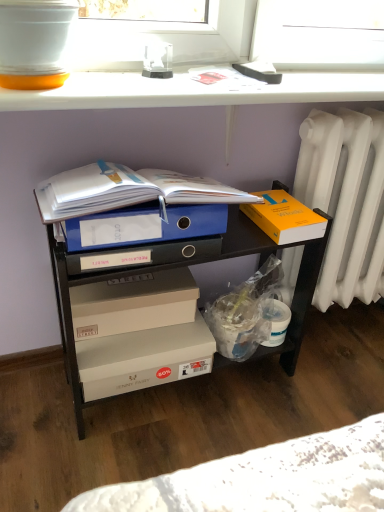
Question: Visually, is blue plastic file at center positioned to the left or to the right of white glossy window sill at upper center?

Choices:
 (A) left
 (B) right

Answer: (A)

Question: From their relative heights in the image, would you say blue plastic file at center is taller or shorter than white glossy window sill at upper center?

Choices:
 (A) tall
 (B) short

Answer: (A)

Question: Estimate the real-world distances between objects in this image. Which object is farther from the white glossy window sill at upper center?

Choices:
 (A) beige cardboard box at center, the second box from the top
 (B) blue plastic file at center
 (C) white cardboard box at center, which is the third box from top to bottom
 (D) white plastic radiator at right
 (E) orange matte book at right, which is the 1th box in top-to-bottom order

Answer: (C)

Question: Which object is the farthest from the beige cardboard box at center, the second box from the top?

Choices:
 (A) blue plastic file at center
 (B) orange matte book at right, which is the 1th box in top-to-bottom order
 (C) white glossy window sill at upper center
 (D) white plastic radiator at right
 (E) white cardboard box at center, which is the third box from top to bottom

Answer: (D)